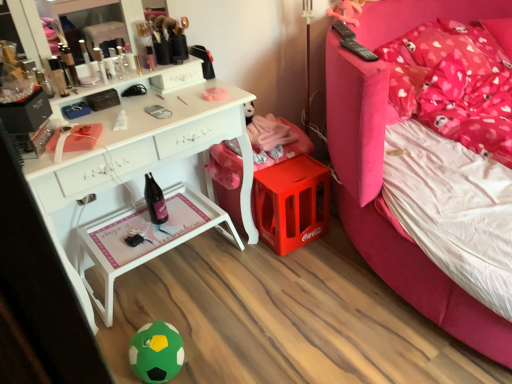
Identify the location of empty space that is ontop of green felt ball at lower center (from a real-world perspective). (156, 337).